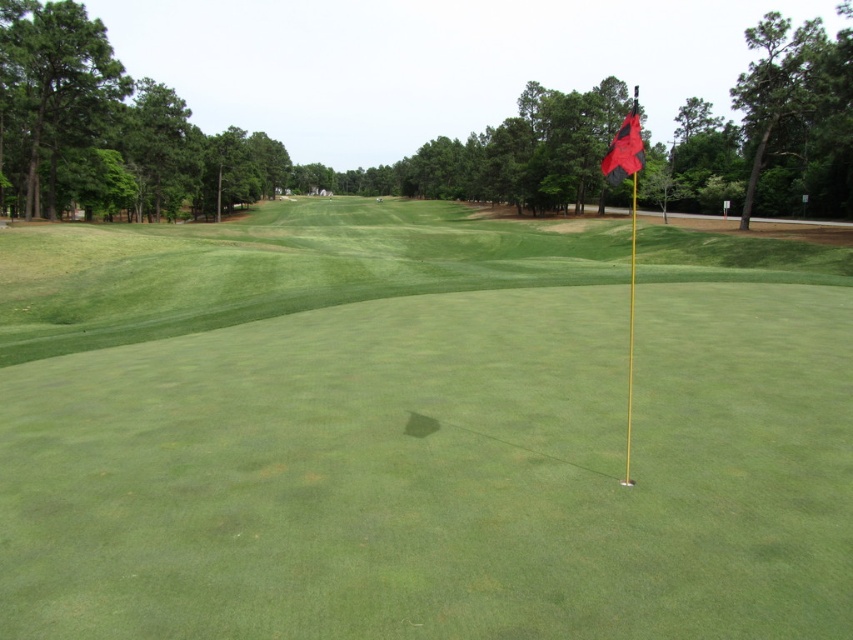
Question: Does green grass at center appear on the left side of red fabric flag at upper right?

Choices:
 (A) yes
 (B) no

Answer: (A)

Question: Can you confirm if green grass at center is wider than red fabric flag at upper right?

Choices:
 (A) no
 (B) yes

Answer: (B)

Question: Which point appears farthest from the camera in this image?

Choices:
 (A) (618, 410)
 (B) (619, 177)

Answer: (A)

Question: Does green grass at center have a larger size compared to red fabric flag at upper right?

Choices:
 (A) yes
 (B) no

Answer: (A)

Question: Which of the following is the farthest from the observer?

Choices:
 (A) (715, 595)
 (B) (618, 152)

Answer: (B)